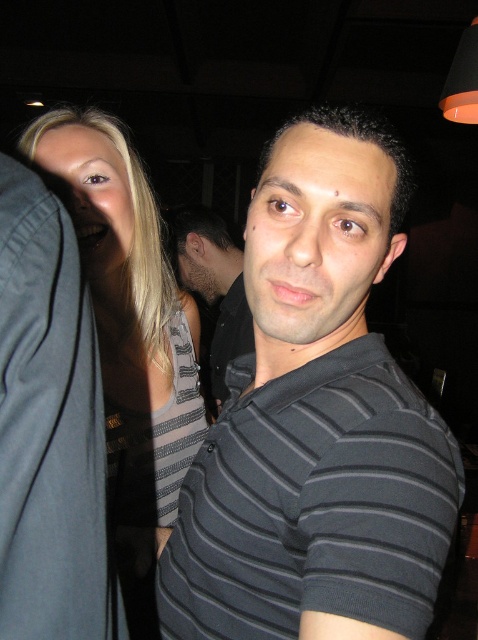
Is blonde hair at left bigger than black striped shirt at center?

Actually, blonde hair at left might be smaller than black striped shirt at center.

This screenshot has height=640, width=478. In order to click on blonde hair at left in this screenshot , I will do `click(129, 336)`.

Identify the location of blonde hair at left. The width and height of the screenshot is (478, 640). (129, 336).

Who is positioned more to the right, dark gray striped polo shirt at center or black striped shirt at center?

dark gray striped polo shirt at center

From the picture: Which is more to the left, dark gray striped polo shirt at center or black striped shirt at center?

black striped shirt at center is more to the left.

Does point (327, 164) lie in front of point (218, 236)?

Yes.

Where is `dark gray striped polo shirt at center`? dark gray striped polo shirt at center is located at coordinates (315, 420).

Is dark gray striped polo shirt at center shorter than blonde hair at left?

Yes, dark gray striped polo shirt at center is shorter than blonde hair at left.

What do you see at coordinates (315, 420) in the screenshot?
I see `dark gray striped polo shirt at center` at bounding box center [315, 420].

Which is behind, point (315, 589) or point (175, 432)?

The point (175, 432) is behind.

The width and height of the screenshot is (478, 640). Identify the location of dark gray striped polo shirt at center. click(315, 420).